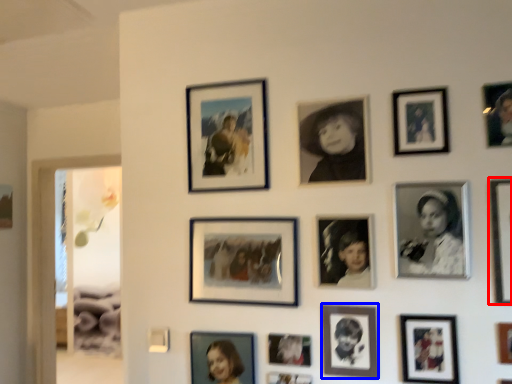
Question: Which of the following is the closest to the observer, picture frame (highlighted by a red box) or picture frame (highlighted by a blue box)?

Choices:
 (A) picture frame
 (B) picture frame

Answer: (A)